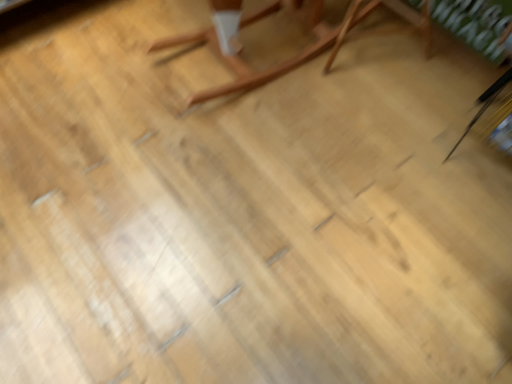
The height and width of the screenshot is (384, 512). Identify the location of vacant point to the left of light brown wood rocking chair at center. (112, 63).